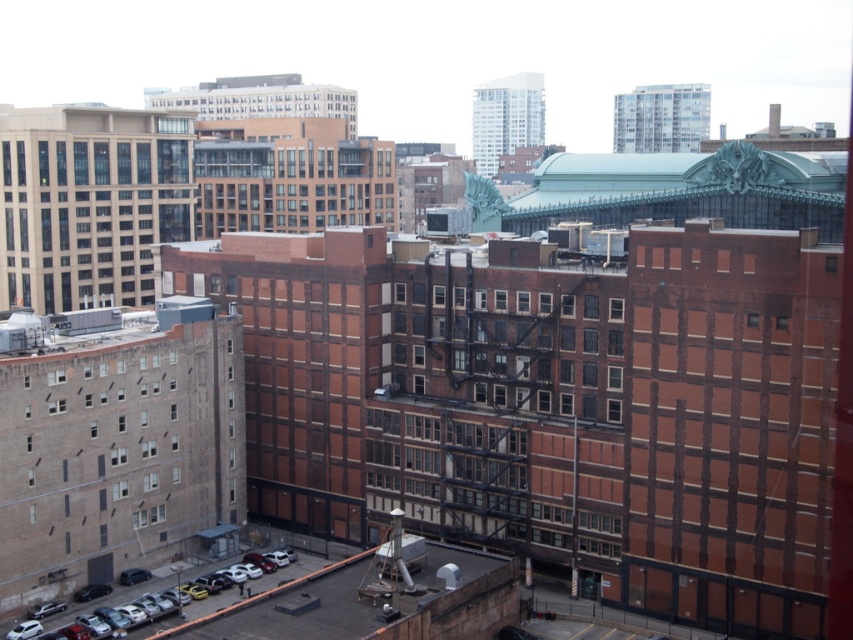
Question: Is white matte car at lower left below white glass window at center?

Choices:
 (A) yes
 (B) no

Answer: (A)

Question: From the image, what is the correct spatial relationship of white matte car at lower left in relation to white glass window at center?

Choices:
 (A) right
 (B) left

Answer: (B)

Question: Does white matte car at lower left appear on the right side of white glass window at center?

Choices:
 (A) no
 (B) yes

Answer: (A)

Question: Which point is closer to the camera taking this photo?

Choices:
 (A) (621, 312)
 (B) (228, 604)

Answer: (B)